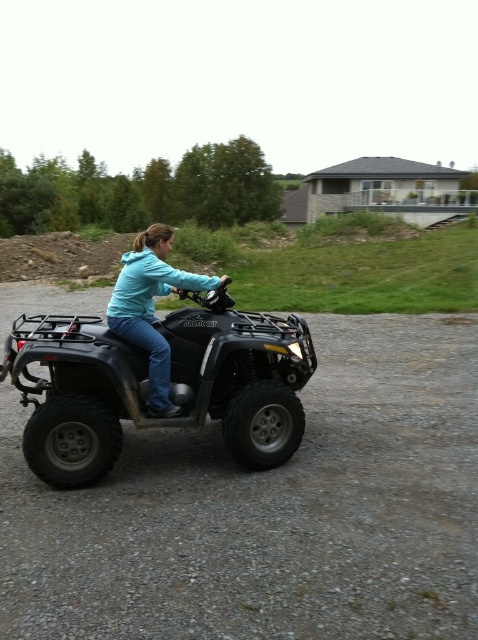
You are a drone operator trying to capture a photo of the ATV rider. You need to ensure that both points, point (283, 392) and point (147, 346), are in focus. Given that your camera can only focus on objects at a single depth plane, which point should you prioritize focusing on to ensure at least one is in focus?

You should prioritize focusing on point (283, 392) because it is closer to the camera than point (147, 346). Since the camera can only focus on one depth plane, focusing on the closer point increases the likelihood that it will be in focus, while the farther point may still be acceptably sharp depending on the depth of field.

Based on the scene description, where is the matte black atv at center located in the image?

The matte black atv at center is located at point (171, 385) in the image.

You are planning to take a photo of the black rubber dirt track at center and the teal matte jacket at center. Which object should you zoom in on to capture both in the frame without moving the camera?

The black rubber dirt track at center is smaller than the teal matte jacket at center, so you should zoom in on the black rubber dirt track at center to include both objects in the frame without moving the camera.